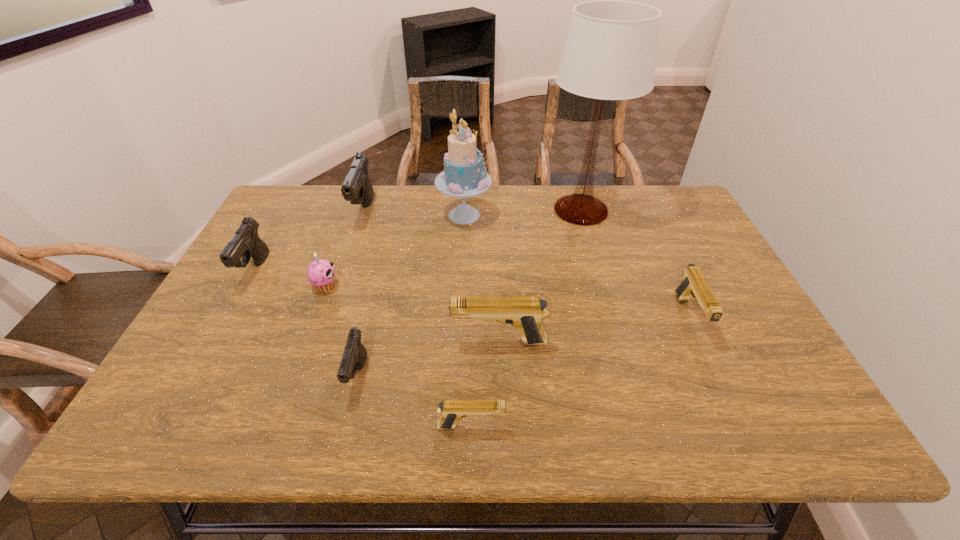
Find the location of `table lamp`. table lamp is located at coordinates (610, 51).

Locate an element on the screen. the tallest object is located at coordinates (610, 51).

I want to click on cake, so click(x=464, y=175).

Image resolution: width=960 pixels, height=540 pixels. I want to click on blue cake, so click(x=464, y=175).

At what (x,y) coordinates should I click in order to perform the action: click on the farthest black pistol. Please return your answer as a coordinate pair (x, y). Looking at the image, I should click on (357, 188).

Where is `the second black pistol from left to right`? Image resolution: width=960 pixels, height=540 pixels. the second black pistol from left to right is located at coordinates (357, 188).

I want to click on the biggest tan pistol, so click(524, 313).

Image resolution: width=960 pixels, height=540 pixels. Find the location of `the leftmost object`. the leftmost object is located at coordinates (246, 243).

Find the location of a particular element. The image size is (960, 540). the second nearest black pistol is located at coordinates (246, 243).

Locate an element on the screen. cupcake is located at coordinates (321, 273).